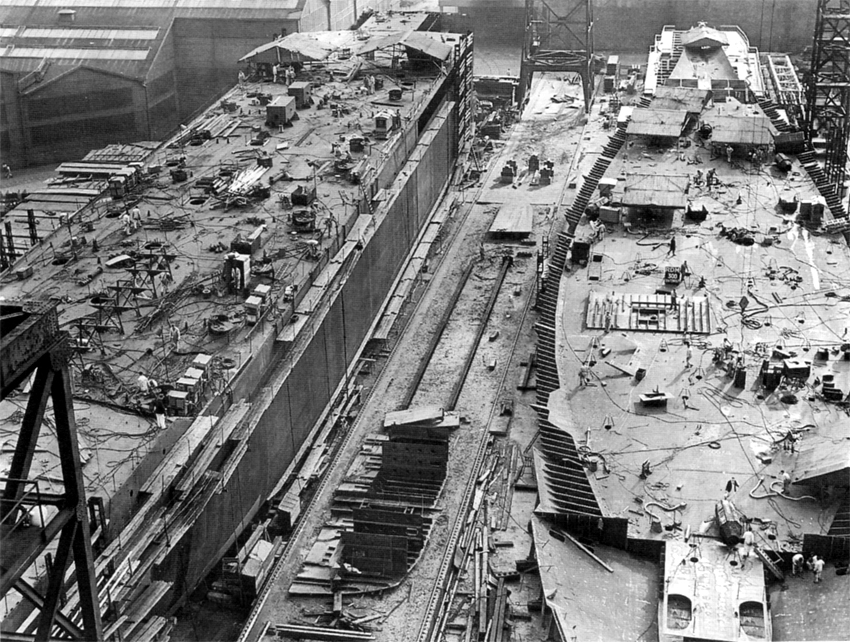
You are a GUI agent. You are given a task and a screenshot of the screen. Output one action in this format:
    pyautogui.click(x=<x>, y=<y>)
    Task: Click on the rod
    The height and width of the screenshot is (642, 850).
    Given the screenshot: What is the action you would take?
    pyautogui.click(x=731, y=437)